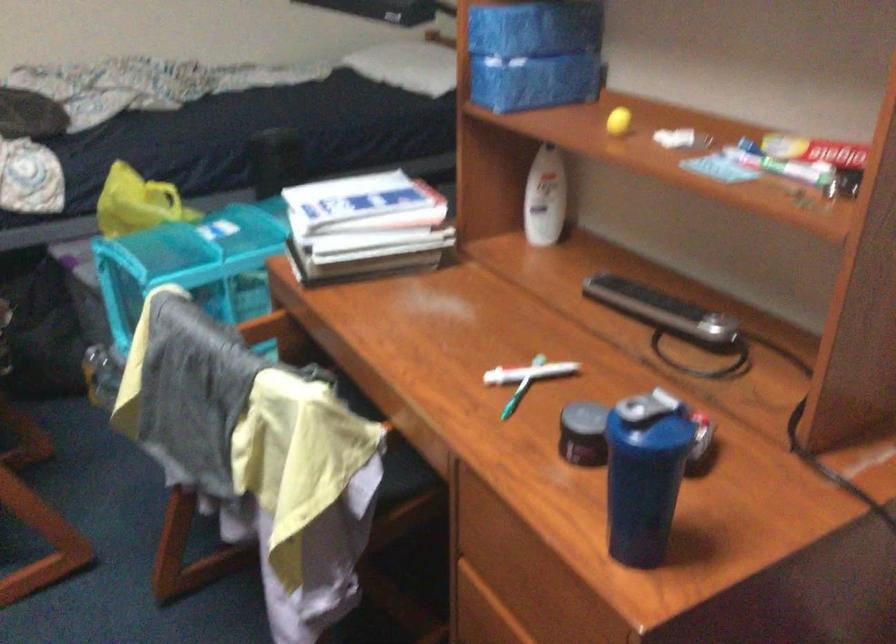
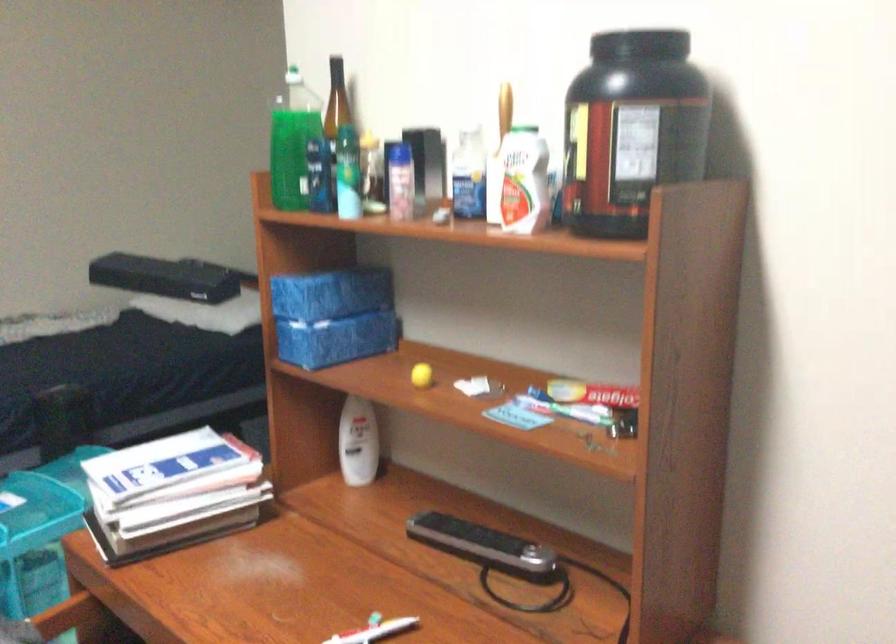
Question: The camera is either moving clockwise (left) or counter-clockwise (right) around the object. The first image is from the beginning of the video and the second image is from the end. Is the camera moving left or right when shooting the video?

Choices:
 (A) Left
 (B) Right

Answer: (A)